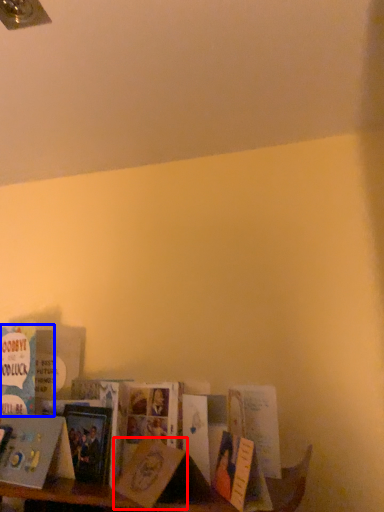
Question: Which object appears farthest to the camera in this image, paperback book (highlighted by a red box) or book (highlighted by a blue box)?

Choices:
 (A) paperback book
 (B) book

Answer: (B)